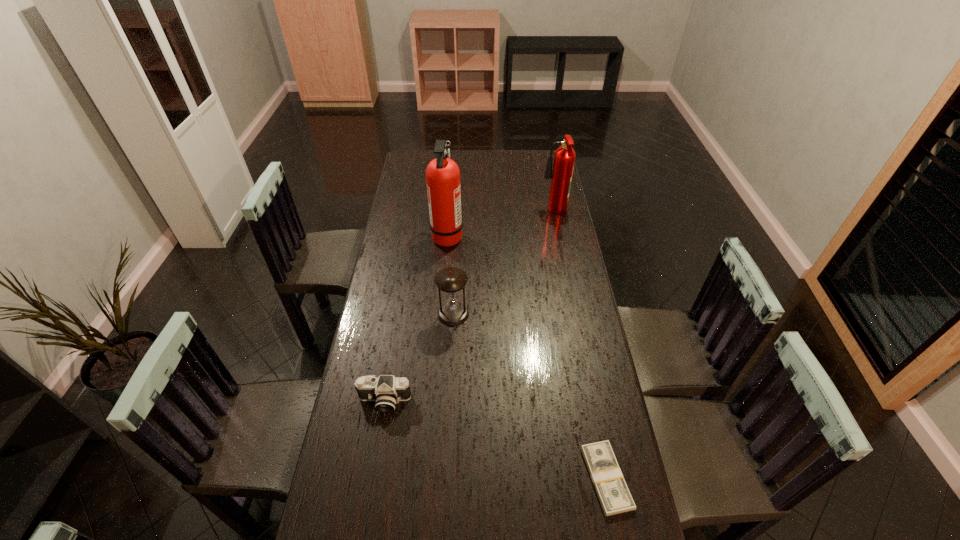
Identify the location of vacant space at the left edge. (407, 226).

You are a GUI agent. You are given a task and a screenshot of the screen. Output one action in this format:
    pyautogui.click(x=<x>, y=<y>)
    Task: Click on the vacant region at the right edge
    Image resolution: width=960 pixels, height=540 pixels.
    Given the screenshot: What is the action you would take?
    pyautogui.click(x=609, y=519)

I want to click on empty location between the shortest object and the tallest object, so click(x=527, y=357).

The width and height of the screenshot is (960, 540). I want to click on free point between the second shortest object and the third nearest object, so click(x=419, y=357).

The height and width of the screenshot is (540, 960). I want to click on free spot between the camera and the shorter fire extinguisher, so click(x=469, y=307).

This screenshot has height=540, width=960. I want to click on vacant area that lies between the hourglass and the right fire extinguisher, so click(504, 264).

I want to click on free space between the right fire extinguisher and the shortest object, so click(x=580, y=345).

Locate an element on the screen. vacant area that lies between the shortest object and the taller fire extinguisher is located at coordinates (527, 357).

Find the location of a particular element. This screenshot has width=960, height=540. object that stands as the third closest to the tallest object is located at coordinates (387, 390).

Identify which object is the third nearest to the second tallest object. Please provide its 2D coordinates. Your answer should be formatted as a tuple, i.e. [(x, y)], where the tuple contains the x and y coordinates of a point satisfying the conditions above.

[(387, 390)]